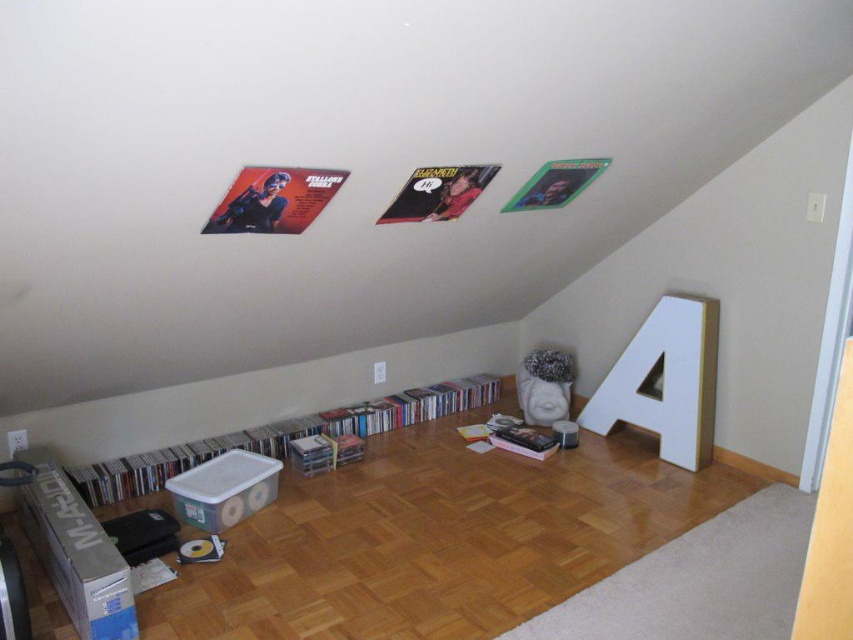
You are organizing items in the attic and need to place a tall bookshelf. The white matte letter a at right and the clear plastic storage at lower center are in the way. Which object should you move first to make space for the tall bookshelf?

You should move the white matte letter a at right first because it is much taller than the clear plastic storage at lower center, so it might block the space needed for the tall bookshelf.

You are organizing items in the attic and need to place a new box between the white matte letter a at right and the clear plastic storage at lower center. Can you fit the box there?

The white matte letter a at right is further to the viewer than the clear plastic storage at lower center, so there is space between them to fit the box.

You are organizing the attic and need to place a new box that is the same size as the clear plastic storage at lower center. Is there enough space next to the white matte letter a at right to fit this new box without moving the existing items?

The white matte letter a at right occupies less space than the clear plastic storage at lower center. Since the new box is the same size as the clear plastic storage at lower center, placing it next to the white matte letter a at right may not leave enough space as the existing letter already takes up less area, implying the available space might be insufficient.